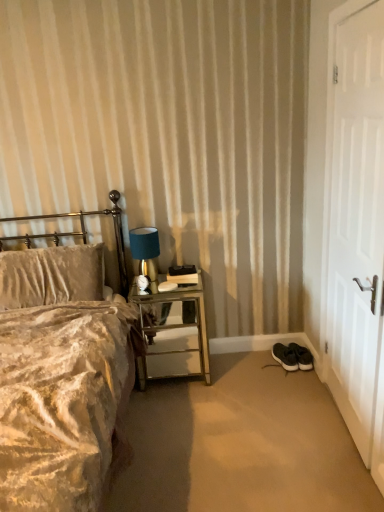
Where is `free spot in front of black suede sneakers at lower right, placed as the 1th footwear when sorted from right to left`? free spot in front of black suede sneakers at lower right, placed as the 1th footwear when sorted from right to left is located at coordinates (304, 376).